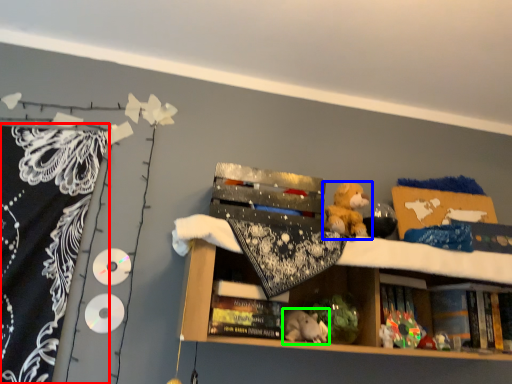
Question: Based on their relative distances, which object is nearer to blanket (highlighted by a red box)? Choose from toy (highlighted by a blue box) and animal (highlighted by a green box).

Choices:
 (A) toy
 (B) animal

Answer: (B)